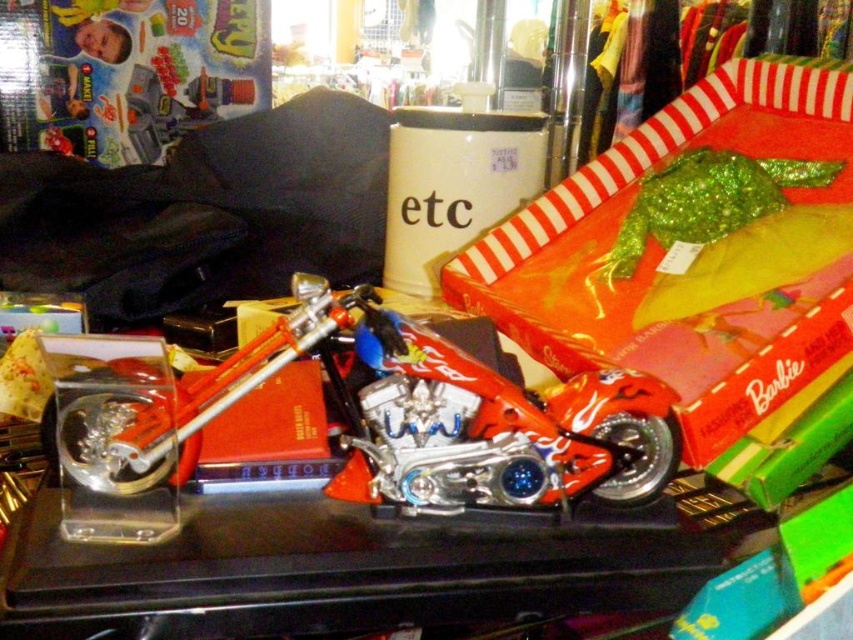
Where is the shiny metallic motorcycle at center located in the image?

The shiny metallic motorcycle at center is located at point [399,420] in the image.

You are organizing a toy store and need to place the shiny metallic motorcycle at center and the shiny red motorcycle at center on a shelf. Which motorcycle takes up more space horizontally?

The shiny metallic motorcycle at center is wider than the shiny red motorcycle at center, so it takes up more horizontal space.